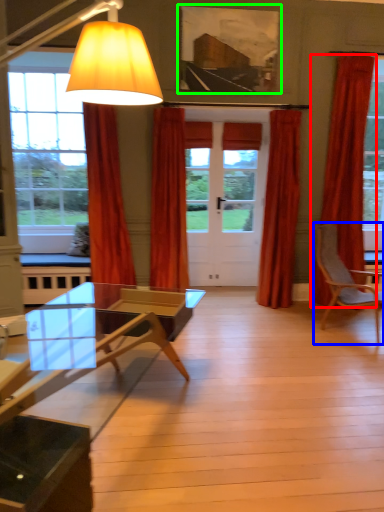
Question: Considering the real-world distances, which object is farthest from curtain (highlighted by a red box)? chair (highlighted by a blue box) or picture frame (highlighted by a green box)?

Choices:
 (A) chair
 (B) picture frame

Answer: (B)